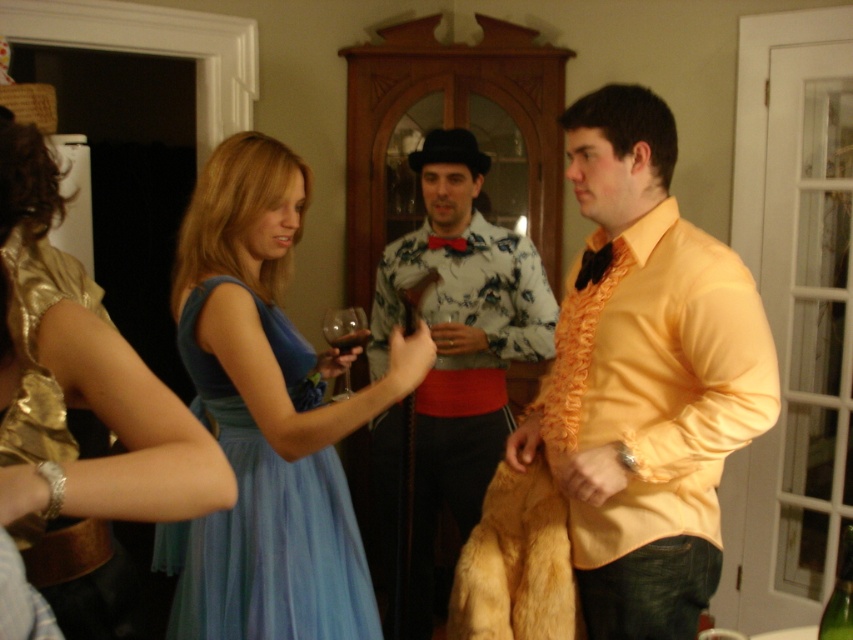
Question: Is light blue tulle dress at center to the left of translucent glass wine at center from the viewer's perspective?

Choices:
 (A) yes
 (B) no

Answer: (A)

Question: Can you confirm if light blue tulle dress at center is bigger than transparent glass at center?

Choices:
 (A) no
 (B) yes

Answer: (B)

Question: Which point appears closest to the camera in this image?

Choices:
 (A) (180, 497)
 (B) (343, 349)
 (C) (451, 316)

Answer: (A)

Question: Can you confirm if matte yellow shirt at center is positioned to the right of translucent glass wine at center?

Choices:
 (A) no
 (B) yes

Answer: (B)

Question: Which of these objects is positioned farthest from the translucent glass wine at center?

Choices:
 (A) light blue tulle dress at center
 (B) floral shirt at center

Answer: (B)

Question: Which object is the farthest from the light blue tulle dress at center?

Choices:
 (A) transparent glass at center
 (B) transparent glass wine glass at center

Answer: (A)